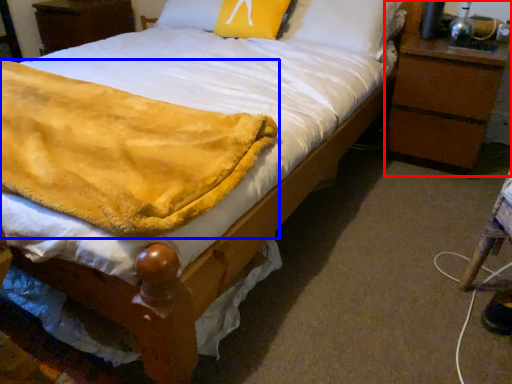
Question: Among these objects, which one is nearest to the camera, nightstand (highlighted by a red box) or blanket (highlighted by a blue box)?

Choices:
 (A) nightstand
 (B) blanket

Answer: (B)